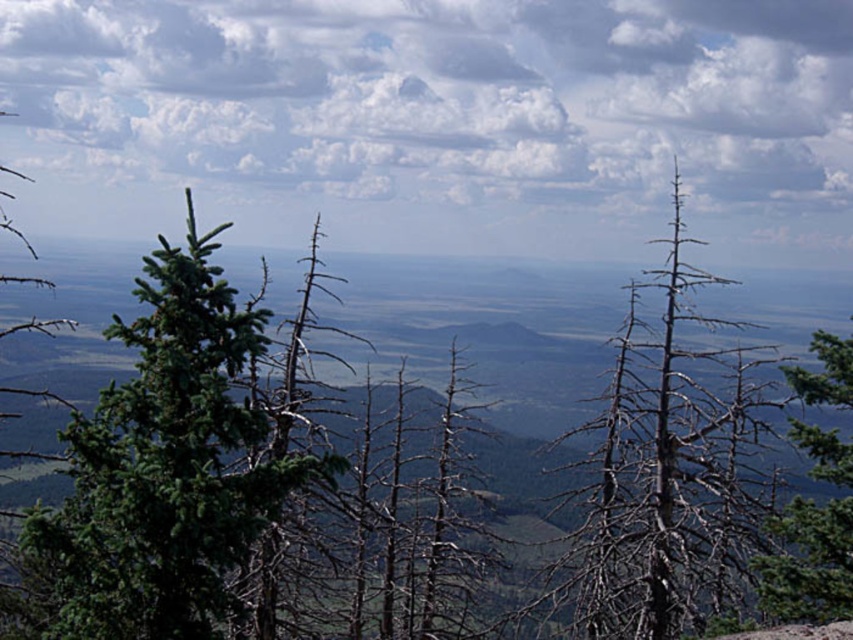
Question: Does green matte evergreen tree at left appear on the right side of green matte tree at right?

Choices:
 (A) no
 (B) yes

Answer: (A)

Question: Which object is the closest to the cloudy sky at upper center?

Choices:
 (A) green matte tree at right
 (B) dead wood tree at center

Answer: (B)

Question: Which object appears farthest from the camera in this image?

Choices:
 (A) green matte tree at right
 (B) dead wood tree at center
 (C) cloudy sky at upper center

Answer: (C)

Question: Among these points, which one is farthest from the camera?

Choices:
 (A) (633, 604)
 (B) (229, 556)
 (C) (845, 74)
 (D) (798, 547)

Answer: (C)

Question: Can you confirm if cloudy sky at upper center is positioned to the right of green matte evergreen tree at left?

Choices:
 (A) no
 (B) yes

Answer: (B)

Question: Can you confirm if green matte evergreen tree at left is smaller than green matte tree at right?

Choices:
 (A) yes
 (B) no

Answer: (A)